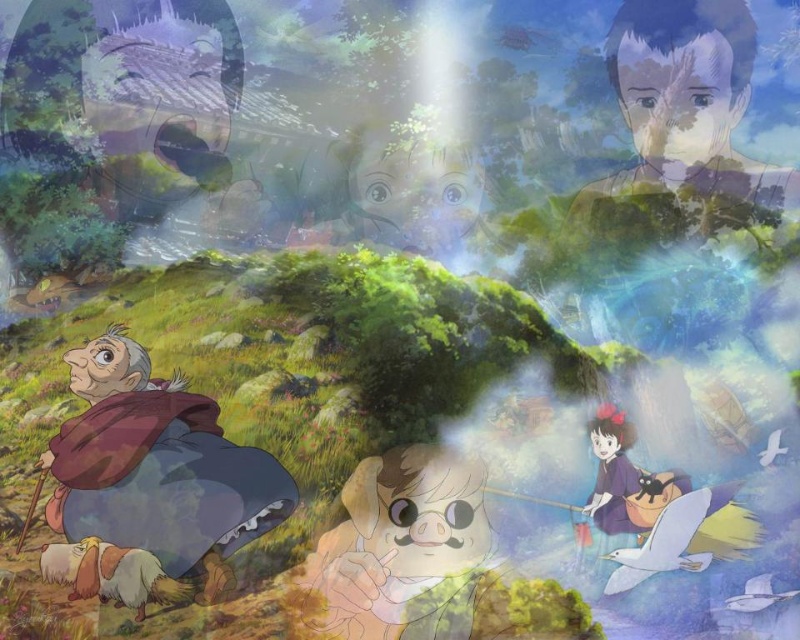
Is point (370, 522) behind point (342, 234)?

No, (370, 522) is in front of (342, 234).

Is smooth beige pig at center behind smooth skin face at center?

No.

The height and width of the screenshot is (640, 800). Describe the element at coordinates (398, 538) in the screenshot. I see `smooth beige pig at center` at that location.

This screenshot has width=800, height=640. Find the location of `smooth beige pig at center`. smooth beige pig at center is located at coordinates (398, 538).

Is brown woolen coat at lower left to the left of smooth skin face at center from the viewer's perspective?

Indeed, brown woolen coat at lower left is positioned on the left side of smooth skin face at center.

Is brown woolen coat at lower left above smooth skin face at center?

Incorrect, brown woolen coat at lower left is not positioned above smooth skin face at center.

Who is more forward, (200, 424) or (366, 192)?

Point (200, 424) is more forward.

Find the location of a particular element. The image size is (800, 640). brown woolen coat at lower left is located at coordinates (154, 477).

Is point (706, 10) farther from viewer compared to point (356, 602)?

That is True.

From the picture: Can you confirm if smooth skin face at upper right is bigger than smooth beige pig at center?

Correct, smooth skin face at upper right is larger in size than smooth beige pig at center.

Is point (732, 12) positioned in front of point (420, 588)?

That is True.

At what (x,y) coordinates should I click in order to perform the action: click on smooth skin face at upper right. Please return your answer as a coordinate pair (x, y). Looking at the image, I should click on (688, 104).